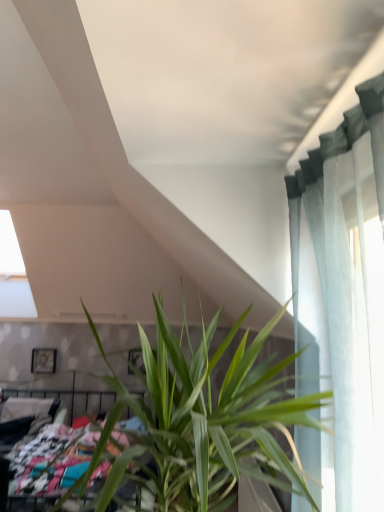
Question: Is multicolored fabric bed at lower left wider or thinner than green leafy plant at center?

Choices:
 (A) wide
 (B) thin

Answer: (A)

Question: Does point (26, 445) appear closer or farther from the camera than point (238, 374)?

Choices:
 (A) closer
 (B) farther

Answer: (B)

Question: Which object is the farthest from the multicolored fabric bed at lower left?

Choices:
 (A) wooden picture frame at upper left
 (B) green leafy plant at center

Answer: (A)

Question: Which object is positioned farthest from the wooden picture frame at upper left?

Choices:
 (A) multicolored fabric bed at lower left
 (B) green leafy plant at center

Answer: (B)